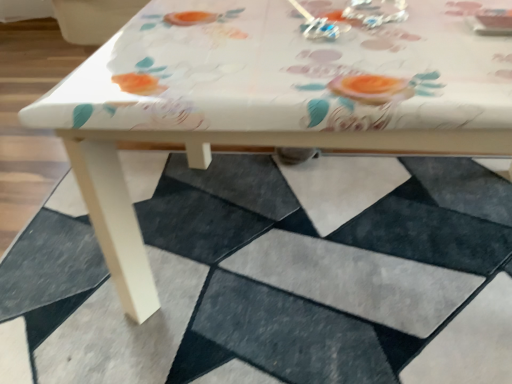
This screenshot has width=512, height=384. In order to click on vacant space in front of metallic silver earrings at upper center in this screenshot , I will do `click(316, 49)`.